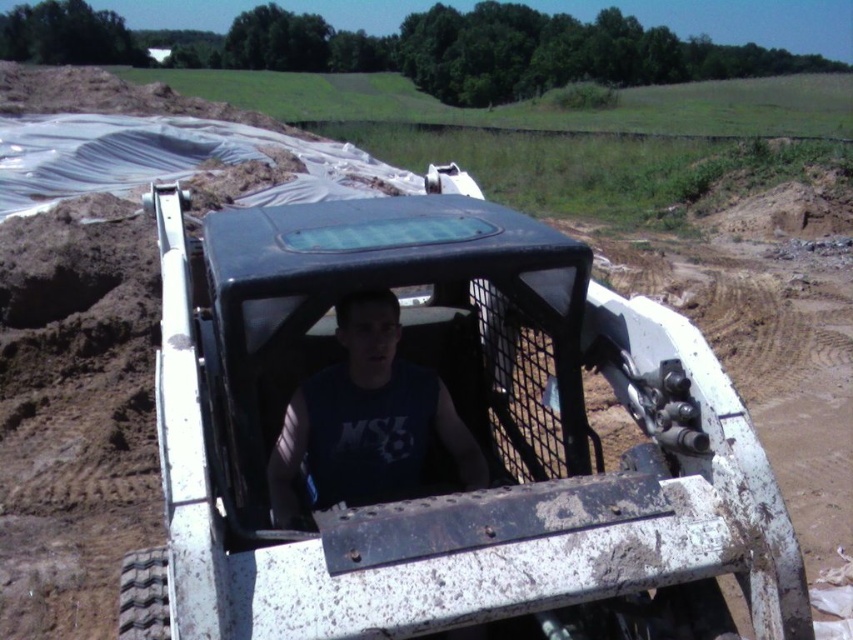
Question: Which point is closer to the camera?

Choices:
 (A) matte black tank top at center
 (B) white matte skid steer at center

Answer: (B)

Question: Which object appears farthest from the camera in this image?

Choices:
 (A) white matte skid steer at center
 (B) matte black tank top at center

Answer: (B)

Question: Is white matte skid steer at center below matte black tank top at center?

Choices:
 (A) no
 (B) yes

Answer: (A)

Question: Which object is farther from the camera taking this photo?

Choices:
 (A) matte black tank top at center
 (B) white matte skid steer at center

Answer: (A)

Question: Can you confirm if white matte skid steer at center is positioned above matte black tank top at center?

Choices:
 (A) no
 (B) yes

Answer: (B)

Question: Considering the relative positions of white matte skid steer at center and matte black tank top at center in the image provided, where is white matte skid steer at center located with respect to matte black tank top at center?

Choices:
 (A) right
 (B) left

Answer: (A)